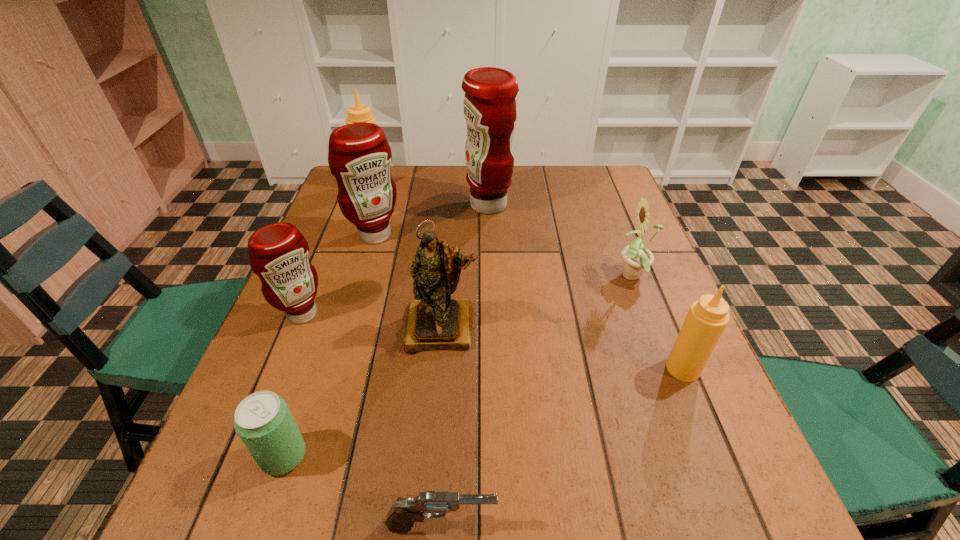
The image size is (960, 540). I want to click on sunflower, so click(x=637, y=259).

Where is `the fourth farthest object`? The width and height of the screenshot is (960, 540). the fourth farthest object is located at coordinates (637, 259).

Locate an element on the screen. This screenshot has height=540, width=960. the second nearest object is located at coordinates (265, 425).

The height and width of the screenshot is (540, 960). In order to click on soda in this screenshot , I will do `click(265, 425)`.

At what (x,y) coordinates should I click in order to perform the action: click on the nearest object. Please return your answer as a coordinate pair (x, y). This screenshot has height=540, width=960. Looking at the image, I should click on (433, 504).

Identify the location of gray pistol. Image resolution: width=960 pixels, height=540 pixels. (433, 504).

Where is `blank space located 0.320m on the right of the tallest condiment`? blank space located 0.320m on the right of the tallest condiment is located at coordinates (619, 205).

This screenshot has width=960, height=540. I want to click on vacant space located on the left of the left tan condiment, so [340, 185].

Identify the location of vacant space located on the right of the second smallest red condiment. This screenshot has height=540, width=960. (532, 235).

This screenshot has height=540, width=960. Find the location of `vacant space located 0.200m on the front-facing side of the figurine`. vacant space located 0.200m on the front-facing side of the figurine is located at coordinates (432, 448).